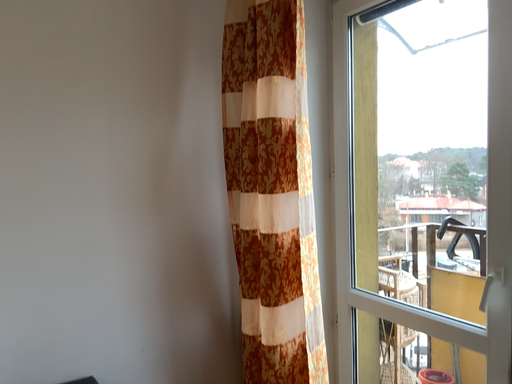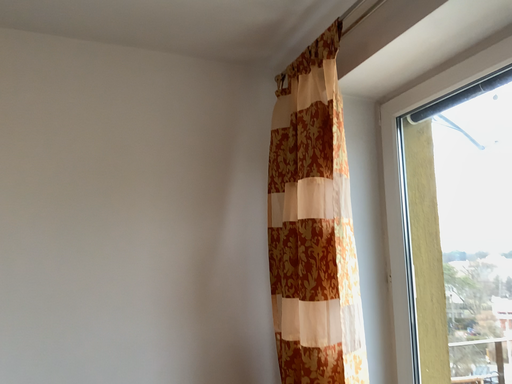
Question: How did the camera likely rotate when shooting the video?

Choices:
 (A) rotated right
 (B) rotated left

Answer: (B)